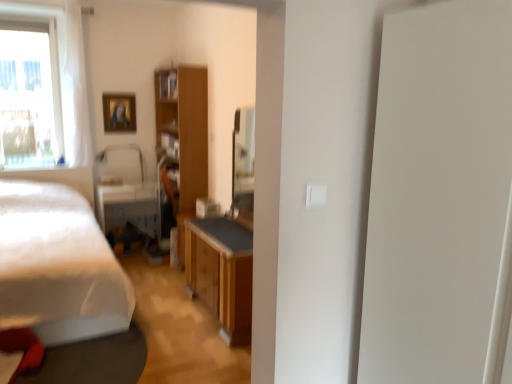
What do you see at coordinates (125, 190) in the screenshot? The width and height of the screenshot is (512, 384). I see `matte black swivel chair at center` at bounding box center [125, 190].

Describe the element at coordinates (74, 89) in the screenshot. The height and width of the screenshot is (384, 512). I see `white sheer curtain at left` at that location.

In order to click on white sheer curtain at left in this screenshot , I will do [74, 89].

What do you see at coordinates (119, 112) in the screenshot?
I see `wooden picture frame at upper left` at bounding box center [119, 112].

The width and height of the screenshot is (512, 384). I want to click on wooden cabinet at center, so click(184, 135).

What is the approximate height of white matte bed at left?

white matte bed at left is 82.89 centimeters in height.

Find the location of a particular element. This screenshot has height=384, width=512. transparent glass window at upper left is located at coordinates (75, 90).

From a real-world perspective, is white sheer curtain at left physically located above or below wooden picture frame at upper left?

From a real-world perspective, white sheer curtain at left is physically above wooden picture frame at upper left.

Is the position of white sheer curtain at left more distant than that of wooden picture frame at upper left?

No, it is in front of wooden picture frame at upper left.

Is point (69, 73) positioned after point (129, 117)?

That is False.

Are white sheer curtain at left and wooden picture frame at upper left located far from each other?

No, white sheer curtain at left is not far away from wooden picture frame at upper left.

Can you confirm if white matte bed at left is taller than transparent glass window at upper left?

In fact, white matte bed at left may be shorter than transparent glass window at upper left.

Is white matte bed at left wider than transparent glass window at upper left?

Indeed, white matte bed at left has a greater width compared to transparent glass window at upper left.

Which object is further away from the camera taking this photo, white matte bed at left or transparent glass window at upper left?

transparent glass window at upper left is behind.

In terms of size, does white matte bed at left appear bigger or smaller than transparent glass window at upper left?

In the image, white matte bed at left appears to be larger than transparent glass window at upper left.

Is white sheer curtain at left facing towards transparent glass window at upper left?

No, white sheer curtain at left does not turn towards transparent glass window at upper left.

Would you say transparent glass window at upper left is part of white sheer curtain at left's contents?

No, transparent glass window at upper left is not surrounded by white sheer curtain at left.

Find the location of `curtain below the transparent glass window at upper left (from a real-world perspective)`. curtain below the transparent glass window at upper left (from a real-world perspective) is located at coordinates (74, 89).

Is matte black swivel chair at center surrounding transparent glass window at upper left?

No, transparent glass window at upper left is located outside of matte black swivel chair at center.

Who is bigger, matte black swivel chair at center or transparent glass window at upper left?

matte black swivel chair at center is bigger.

From a real-world perspective, is matte black swivel chair at center physically above transparent glass window at upper left?

No.

Between point (112, 158) and point (80, 8), which one is positioned behind?

The point (112, 158) is more distant.

Does matte black swivel chair at center lie behind wooden cabinet at center?

Yes, it is behind wooden cabinet at center.

Considering the sizes of objects matte black swivel chair at center and wooden cabinet at center in the image provided, who is shorter, matte black swivel chair at center or wooden cabinet at center?

matte black swivel chair at center is shorter.

Is matte black swivel chair at center looking in the opposite direction of wooden cabinet at center?

That's not correct — matte black swivel chair at center is not looking away from wooden cabinet at center.

Locate an element on the screen. swivel chair located on the left of wooden cabinet at center is located at coordinates (125, 190).

Considering the positions of objects transparent glass window at upper left and white sheer curtain at left in the image provided, who is more to the right, transparent glass window at upper left or white sheer curtain at left?

white sheer curtain at left.

Does point (68, 80) lie behind point (80, 100)?

That is False.

What's the angular difference between transparent glass window at upper left and white sheer curtain at left's facing directions?

0.000703 degrees separate the facing orientations of transparent glass window at upper left and white sheer curtain at left.

Which of these two, transparent glass window at upper left or white sheer curtain at left, is thinner?

transparent glass window at upper left.

Is white sheer curtain at left wider or thinner than white matte bed at left?

white sheer curtain at left is thinner than white matte bed at left.

Is white sheer curtain at left spatially inside white matte bed at left, or outside of it?

white sheer curtain at left is located beyond the bounds of white matte bed at left.

You are a GUI agent. You are given a task and a screenshot of the screen. Output one action in this format:
    pyautogui.click(x=<x>, y=<y>)
    Task: Click on the picture frame lying on the right of white sheer curtain at left
    
    Given the screenshot: What is the action you would take?
    click(119, 112)

Image resolution: width=512 pixels, height=384 pixels. I want to click on bed in front of the transparent glass window at upper left, so click(58, 266).

Based on their spatial positions, is wooden cabinet at center or white matte bed at left further from white sheer curtain at left?

white matte bed at left lies further to white sheer curtain at left than the other object.

Considering their positions, is matte black swivel chair at center positioned further to transparent glass window at upper left than wooden picture frame at upper left?

The object further to transparent glass window at upper left is matte black swivel chair at center.

From the image, which object appears to be nearer to transparent glass window at upper left, wooden cabinet at center or white sheer curtain at left?

The object closer to transparent glass window at upper left is white sheer curtain at left.

When comparing their distances from white sheer curtain at left, does transparent glass window at upper left or matte black swivel chair at center seem closer?

transparent glass window at upper left is positioned closer to the anchor white sheer curtain at left.

When comparing their distances from wooden picture frame at upper left, does white matte bed at left or wooden cabinet at center seem closer?

Among the two, wooden cabinet at center is located nearer to wooden picture frame at upper left.

When comparing their distances from white sheer curtain at left, does wooden cabinet at center or matte black swivel chair at center seem closer?

Based on the image, matte black swivel chair at center appears to be nearer to white sheer curtain at left.

Estimate the real-world distances between objects in this image. Which object is closer to transparent glass window at upper left, matte black swivel chair at center or white matte bed at left?

matte black swivel chair at center is positioned closer to the anchor transparent glass window at upper left.

Considering their positions, is transparent glass window at upper left positioned closer to wooden picture frame at upper left than wooden cabinet at center?

transparent glass window at upper left is closer to wooden picture frame at upper left.

Where is `window between white matte bed at left and white sheer curtain at left in the front-back direction`? This screenshot has width=512, height=384. window between white matte bed at left and white sheer curtain at left in the front-back direction is located at coordinates coord(75,90).

Locate an element on the screen. The height and width of the screenshot is (384, 512). cabinetry between white matte bed at left and wooden picture frame at upper left from front to back is located at coordinates (184, 135).

Where is `picture frame between transparent glass window at upper left and matte black swivel chair at center from top to bottom`? picture frame between transparent glass window at upper left and matte black swivel chair at center from top to bottom is located at coordinates (119, 112).

Locate an element on the screen. The height and width of the screenshot is (384, 512). window between white matte bed at left and wooden cabinet at center in the front-back direction is located at coordinates (75, 90).